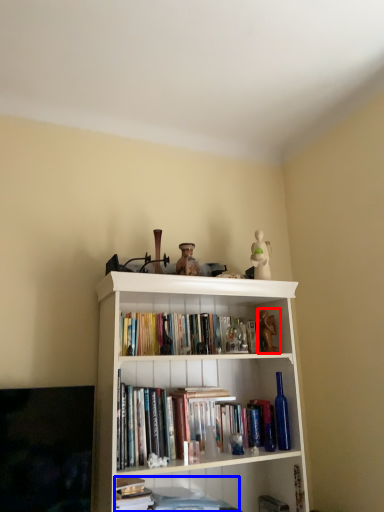
Question: Which object is closer to the camera taking this photo, toy (highlighted by a red box) or book (highlighted by a blue box)?

Choices:
 (A) toy
 (B) book

Answer: (B)